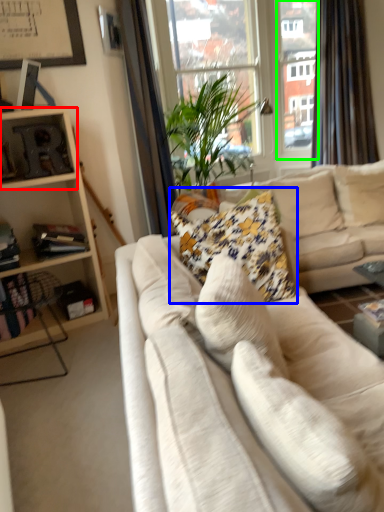
Question: Which is farther away from shelf (highlighted by a red box)? pillow (highlighted by a blue box) or window frame (highlighted by a green box)?

Choices:
 (A) pillow
 (B) window frame

Answer: (B)